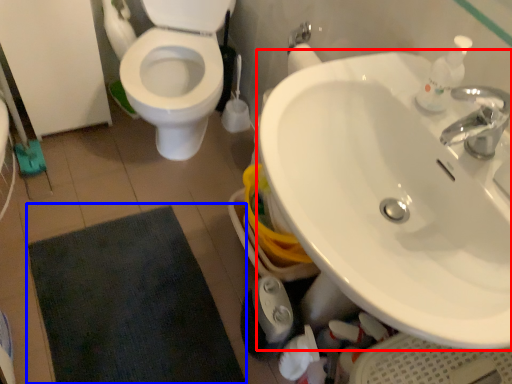
Question: Which point is further to the camera, sink (highlighted by a red box) or bath mat (highlighted by a blue box)?

Choices:
 (A) sink
 (B) bath mat

Answer: (B)